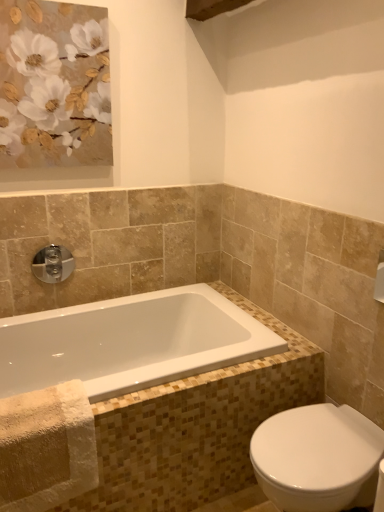
This screenshot has height=512, width=384. What do you see at coordinates (53, 264) in the screenshot?
I see `chrome/metallic faucet at upper left` at bounding box center [53, 264].

What do you see at coordinates (130, 342) in the screenshot? Image resolution: width=384 pixels, height=512 pixels. I see `white glossy bathtub at lower left` at bounding box center [130, 342].

What do you see at coordinates (54, 86) in the screenshot? The height and width of the screenshot is (512, 384). I see `matte gold flowers at upper left` at bounding box center [54, 86].

The width and height of the screenshot is (384, 512). Identify the location of chrome/metallic faucet at upper left. (53, 264).

From a real-world perspective, is chrome/metallic faucet at upper left on top of matte gold flowers at upper left?

No, from a real-world perspective, chrome/metallic faucet at upper left is not over matte gold flowers at upper left

Looking at this image, is chrome/metallic faucet at upper left inside the boundaries of matte gold flowers at upper left, or outside?

chrome/metallic faucet at upper left exists outside the volume of matte gold flowers at upper left.

Looking at this image, from the image's perspective, relative to white glossy bathtub at lower left, is white glossy bidet at lower right above or below?

From the image's perspective, white glossy bidet at lower right appears below white glossy bathtub at lower left.

Consider the image. How distant is white glossy bidet at lower right from white glossy bathtub at lower left?

white glossy bidet at lower right and white glossy bathtub at lower left are 23.62 inches apart from each other.

From a real-world perspective, is white glossy bidet at lower right below white glossy bathtub at lower left?

Indeed, from a real-world perspective, white glossy bidet at lower right is positioned beneath white glossy bathtub at lower left.

Does white glossy bidet at lower right have a larger size compared to white glossy bathtub at lower left?

Yes.

Is white glossy bathtub at lower left inside or outside of matte gold flowers at upper left?

white glossy bathtub at lower left cannot be found inside matte gold flowers at upper left.

How much distance is there between white glossy bathtub at lower left and matte gold flowers at upper left?

white glossy bathtub at lower left and matte gold flowers at upper left are 3.31 feet apart from each other.

From a real-world perspective, who is located lower, white glossy bathtub at lower left or matte gold flowers at upper left?

white glossy bathtub at lower left is physically lower.

Considering the sizes of objects white glossy bathtub at lower left and matte gold flowers at upper left in the image provided, who is smaller, white glossy bathtub at lower left or matte gold flowers at upper left?

matte gold flowers at upper left.

Is white glossy bathtub at lower left positioned behind white glossy bidet at lower right?

Yes, it is.

Is white glossy bathtub at lower left to the right of white glossy bidet at lower right from the viewer's perspective?

Incorrect, white glossy bathtub at lower left is not on the right side of white glossy bidet at lower right.

Is white glossy bathtub at lower left shorter than white glossy bidet at lower right?

Yes.

Which point is more forward, (7, 333) or (382, 446)?

Positioned in front is point (382, 446).

Is chrome/metallic faucet at upper left behind white glossy bathtub at lower left?

Yes.

Is the surface of chrome/metallic faucet at upper left in direct contact with white glossy bathtub at lower left?

chrome/metallic faucet at upper left is not next to white glossy bathtub at lower left, and they're not touching.

Is chrome/metallic faucet at upper left facing towards white glossy bathtub at lower left?

No, chrome/metallic faucet at upper left is not facing towards white glossy bathtub at lower left.

From the image's perspective, is white glossy bidet at lower right under matte gold flowers at upper left?

Yes, from the image's perspective, white glossy bidet at lower right is beneath matte gold flowers at upper left.

Find the location of a particular element. bidet that appears below the matte gold flowers at upper left (from the image's perspective) is located at coordinates (x=317, y=458).

Which object is wider, white glossy bidet at lower right or matte gold flowers at upper left?

white glossy bidet at lower right.

Who is more distant, white glossy bidet at lower right or matte gold flowers at upper left?

matte gold flowers at upper left is more distant.

Relative to chrome/metallic faucet at upper left, is white glossy bidet at lower right in front or behind?

white glossy bidet at lower right is in front of chrome/metallic faucet at upper left.

From the image's perspective, does white glossy bidet at lower right appear higher than chrome/metallic faucet at upper left?

No, from the image's perspective, white glossy bidet at lower right is not on top of chrome/metallic faucet at upper left.

You are a GUI agent. You are given a task and a screenshot of the screen. Output one action in this format:
    pyautogui.click(x=<x>, y=<y>)
    Task: Click on the tap above the white glossy bidet at lower right (from the image's perspective)
    This screenshot has height=512, width=384.
    Given the screenshot: What is the action you would take?
    pyautogui.click(x=53, y=264)

Is white glossy bidet at lower right oriented towards chrome/metallic faucet at upper left?

No.

Identify the location of flower above the chrome/metallic faucet at upper left (from a real-world perspective). Image resolution: width=384 pixels, height=512 pixels. (54, 86).

Where is `bidet that is on the right side of white glossy bathtub at lower left`? bidet that is on the right side of white glossy bathtub at lower left is located at coordinates (317, 458).

Which object lies nearer to the anchor point matte gold flowers at upper left, chrome/metallic faucet at upper left or white glossy bathtub at lower left?

Among the two, chrome/metallic faucet at upper left is located nearer to matte gold flowers at upper left.

Consider the image. Looking at the image, which one is located further to chrome/metallic faucet at upper left, white glossy bidet at lower right or matte gold flowers at upper left?

white glossy bidet at lower right is further to chrome/metallic faucet at upper left.

Considering their positions, is matte gold flowers at upper left positioned further to chrome/metallic faucet at upper left than white glossy bathtub at lower left?

Among the two, matte gold flowers at upper left is located further to chrome/metallic faucet at upper left.

Estimate the real-world distances between objects in this image. Which object is closer to chrome/metallic faucet at upper left, white glossy bathtub at lower left or matte gold flowers at upper left?

white glossy bathtub at lower left is closer to chrome/metallic faucet at upper left.

When comparing their distances from white glossy bidet at lower right, does matte gold flowers at upper left or white glossy bathtub at lower left seem closer?

Among the two, white glossy bathtub at lower left is located nearer to white glossy bidet at lower right.

Considering their positions, is matte gold flowers at upper left positioned closer to chrome/metallic faucet at upper left than white glossy bidet at lower right?

matte gold flowers at upper left lies closer to chrome/metallic faucet at upper left than the other object.

Estimate the real-world distances between objects in this image. Which object is closer to white glossy bathtub at lower left, white glossy bidet at lower right or matte gold flowers at upper left?

Based on the image, white glossy bidet at lower right appears to be nearer to white glossy bathtub at lower left.

Considering their positions, is chrome/metallic faucet at upper left positioned closer to matte gold flowers at upper left than white glossy bidet at lower right?

Based on the image, chrome/metallic faucet at upper left appears to be nearer to matte gold flowers at upper left.

The image size is (384, 512). Identify the location of tap between matte gold flowers at upper left and white glossy bidet at lower right from top to bottom. (53, 264).

What are the coordinates of `bathtub located between chrome/metallic faucet at upper left and white glossy bidet at lower right in the left-right direction` in the screenshot? It's located at click(130, 342).

What are the coordinates of `bathtub between matte gold flowers at upper left and white glossy bidet at lower right in the vertical direction` in the screenshot? It's located at (130, 342).

Locate an element on the screen. tap between matte gold flowers at upper left and white glossy bathtub at lower left vertically is located at coordinates (53, 264).